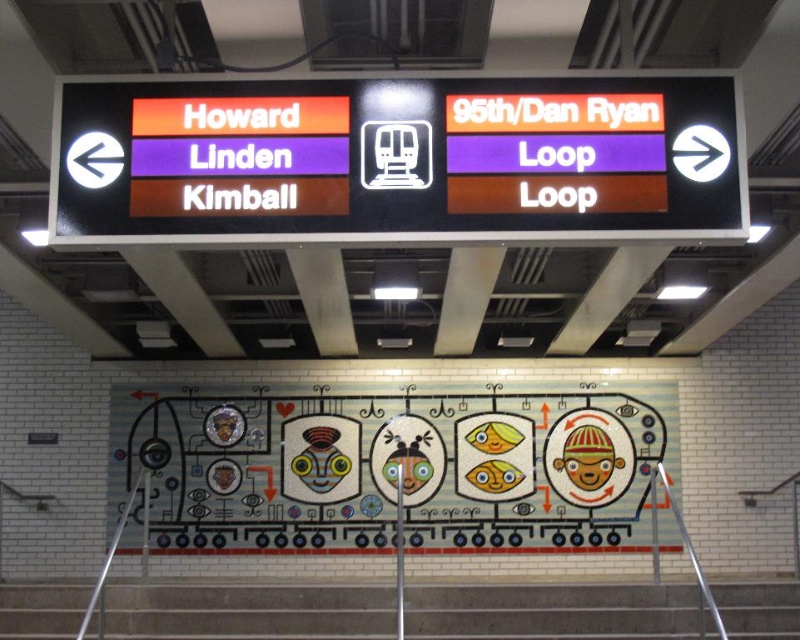
You are a subway passenger holding a map that shows the matte orange sign at center and the gray concrete stairs at lower center. According to the map, which object is bigger?

The matte orange sign at center is larger in size compared to the gray concrete stairs at lower center.

You are at the subway station and need to go down the stairs. You see the matte orange sign at center and the gray concrete stairs at lower center. Which one is located to the right side from your perspective?

The matte orange sign at center is to the right of the gray concrete stairs at lower center, so the matte orange sign at center is on the right side.